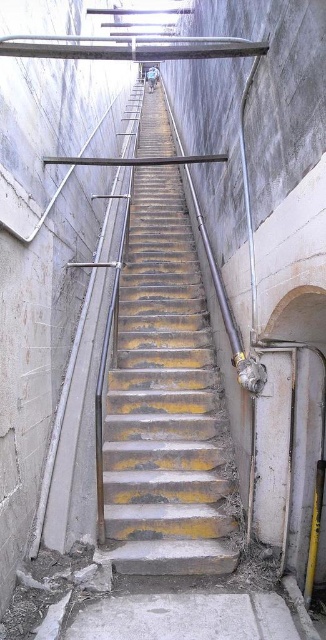
Question: Which point is farther to the camera?

Choices:
 (A) yellow painted metal stairs at center
 (B) gray concrete floor at bottom

Answer: (A)

Question: Is yellow painted metal stairs at center closer to camera compared to gray concrete floor at bottom?

Choices:
 (A) no
 (B) yes

Answer: (A)

Question: Is yellow painted metal stairs at center positioned at the back of gray concrete floor at bottom?

Choices:
 (A) yes
 (B) no

Answer: (A)

Question: Which object appears closest to the camera in this image?

Choices:
 (A) gray concrete floor at bottom
 (B) yellow painted metal stairs at center

Answer: (A)

Question: Is yellow painted metal stairs at center to the right of gray concrete floor at bottom from the viewer's perspective?

Choices:
 (A) yes
 (B) no

Answer: (B)